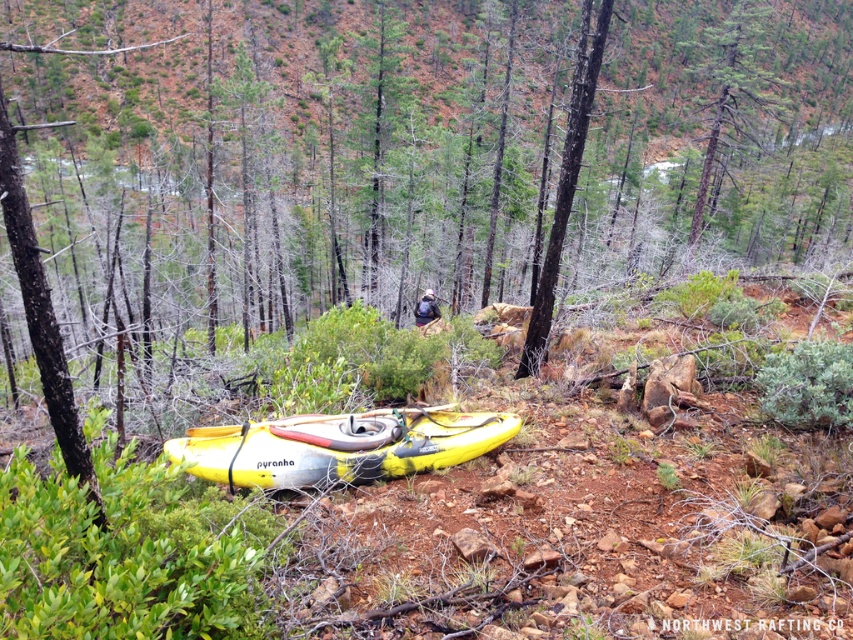
Who is positioned more to the right, yellow matte kayak at center or smooth bark tree at center?

From the viewer's perspective, smooth bark tree at center appears more on the right side.

Which is more to the left, yellow matte kayak at center or smooth bark tree at center?

From the viewer's perspective, yellow matte kayak at center appears more on the left side.

Does point (190, 440) lie in front of point (560, 170)?

Yes, point (190, 440) is closer to viewer.

Where is `yellow matte kayak at center`? yellow matte kayak at center is located at coordinates (339, 445).

Is yellow matte kayak at center bigger than smooth brown tree trunk at upper center?

No.

Who is more forward, [469,413] or [738,61]?

Point [469,413] is in front.

What do you see at coordinates (339, 445) in the screenshot? The width and height of the screenshot is (853, 640). I see `yellow matte kayak at center` at bounding box center [339, 445].

At what (x,y) coordinates should I click in order to perform the action: click on yellow matte kayak at center. Please return your answer as a coordinate pair (x, y). This screenshot has height=640, width=853. Looking at the image, I should click on (339, 445).

Is point (753, 140) behind point (579, 68)?

Yes, point (753, 140) is farther from viewer.

Between point (749, 108) and point (550, 253), which one is positioned behind?

The point (749, 108) is more distant.

Is point (769, 112) closer to viewer compared to point (578, 106)?

No, it is behind (578, 106).

I want to click on smooth brown tree trunk at upper center, so click(x=733, y=97).